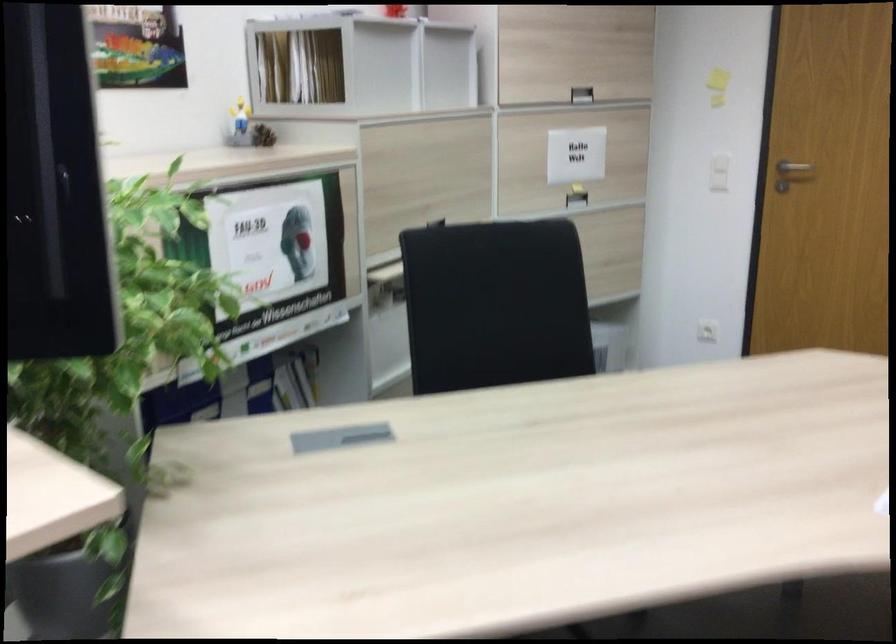
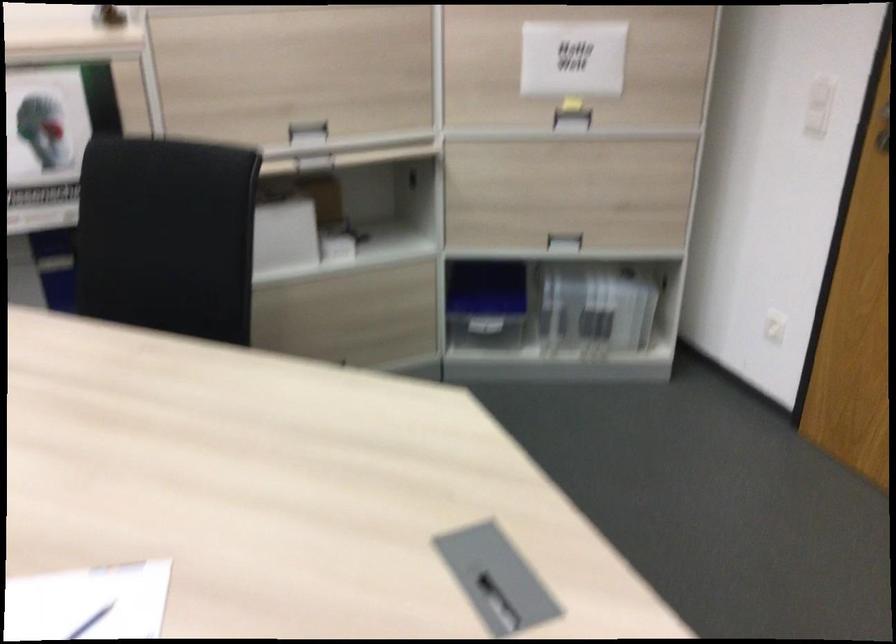
In the second image, find the point that corresponds to the point at 433,222 in the first image.

(307, 129)